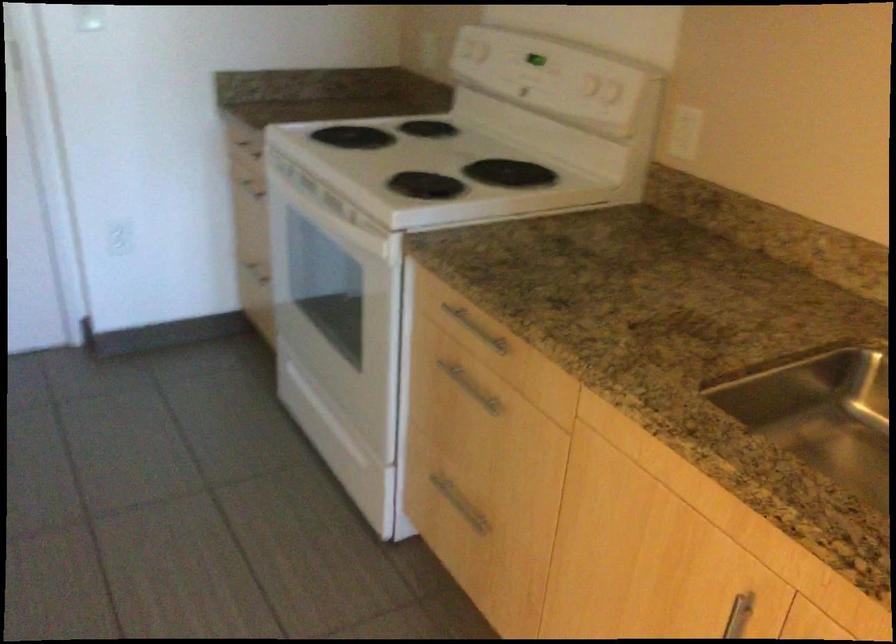
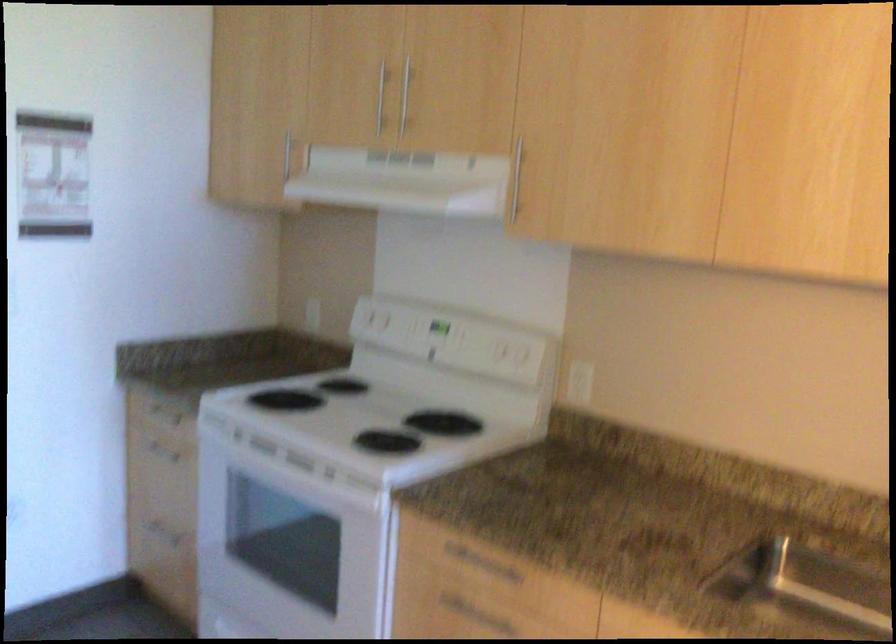
In the second image, find the point that corresponds to (x=397, y=324) in the first image.

(385, 571)